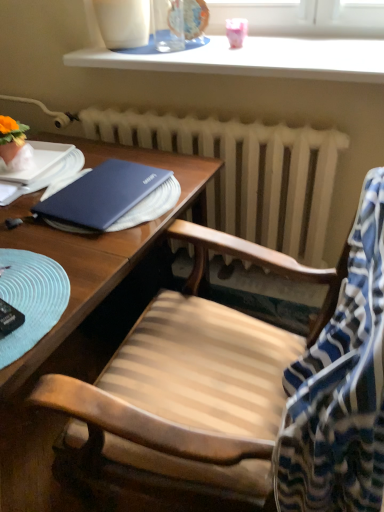
Where is `free space in front of matte blue notebook at center`? This screenshot has width=384, height=512. free space in front of matte blue notebook at center is located at coordinates (73, 256).